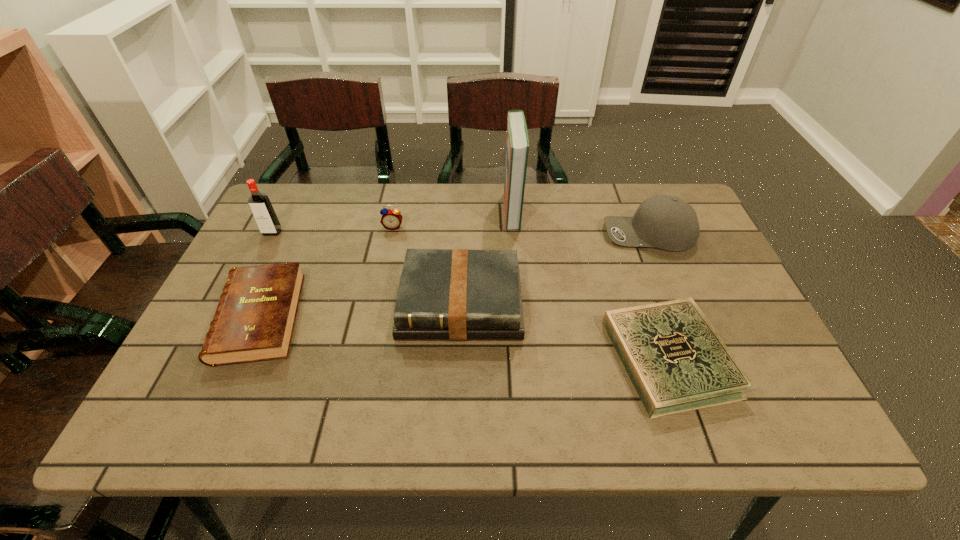
You are a GUI agent. You are given a task and a screenshot of the screen. Output one action in this format:
    pyautogui.click(x=<x>, y=<y>)
    Task: Click on the vacant space positioned 0.130m on the back of the rightmost hardback book
    
    Given the screenshot: What is the action you would take?
    pyautogui.click(x=639, y=271)

Find the location of a particular element. hardback book at the far edge is located at coordinates 517,144.

The image size is (960, 540). What are the coordinates of `vodka situated at the far edge` in the screenshot? It's located at (260, 205).

Identify the location of baseball cap that is at the far edge. This screenshot has height=540, width=960. (666, 222).

Where is `alarm clock present at the far edge`? This screenshot has width=960, height=540. alarm clock present at the far edge is located at coordinates (391, 219).

The width and height of the screenshot is (960, 540). Identify the location of object at the near edge. (676, 361).

Where is `vodka that is at the left edge`? The image size is (960, 540). vodka that is at the left edge is located at coordinates (260, 205).

At what (x,y) coordinates should I click in order to perform the action: click on hardback book that is at the left edge. Please return your answer as a coordinate pair (x, y). Looking at the image, I should click on (254, 321).

Find the location of a particular element. This screenshot has width=960, height=540. baseball cap that is at the right edge is located at coordinates (666, 222).

I want to click on hardback book that is at the right edge, so click(x=676, y=361).